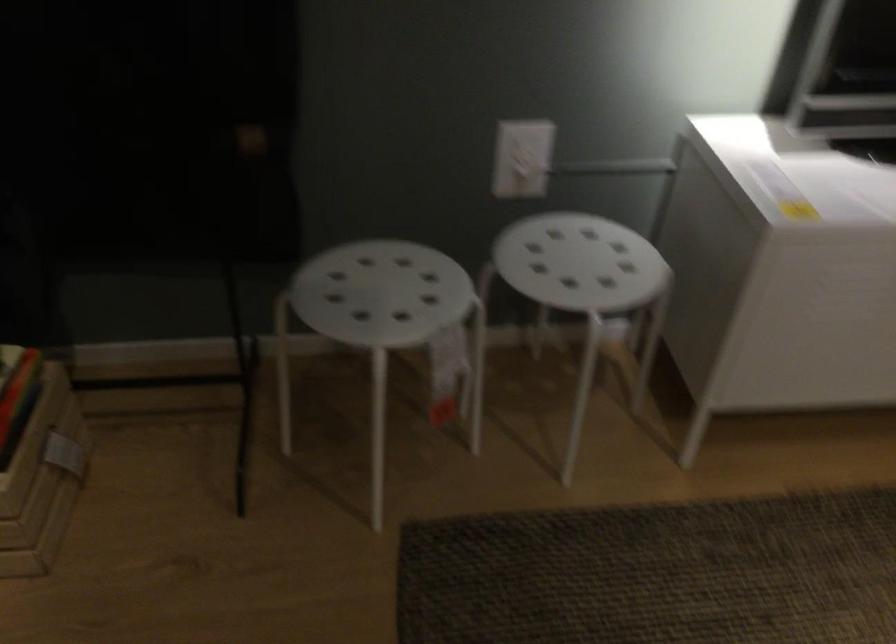
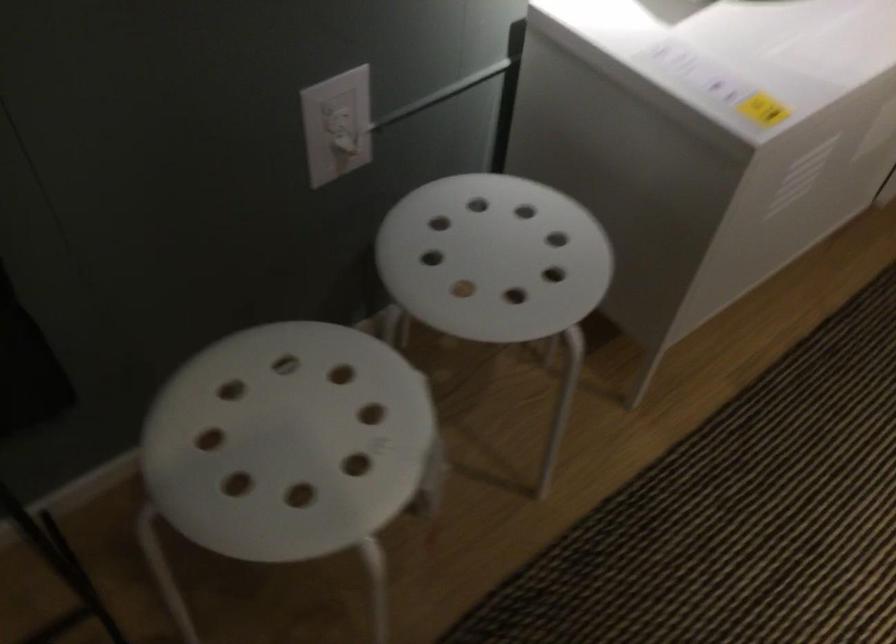
In the second image, find the point that corresponds to point 522,152 in the first image.

(337, 125)